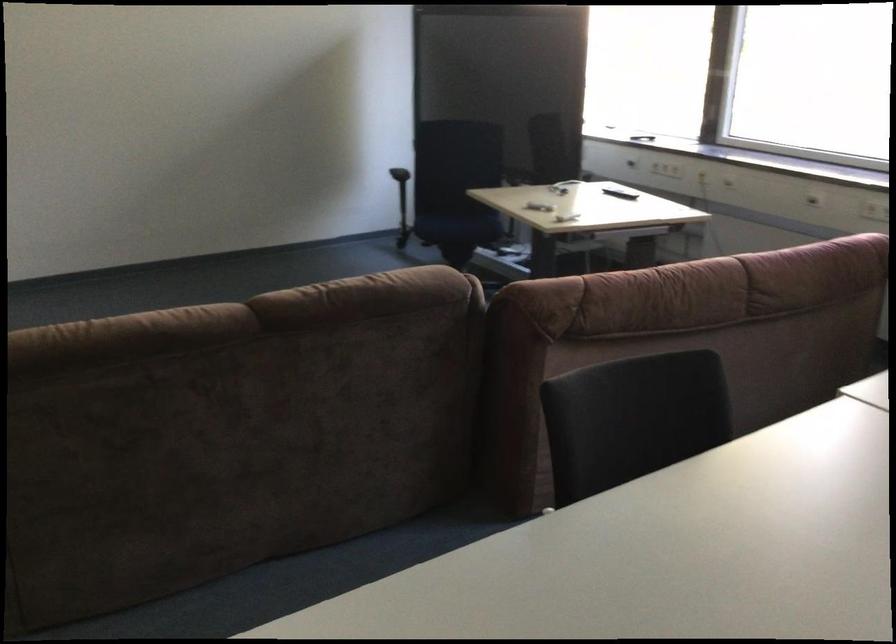
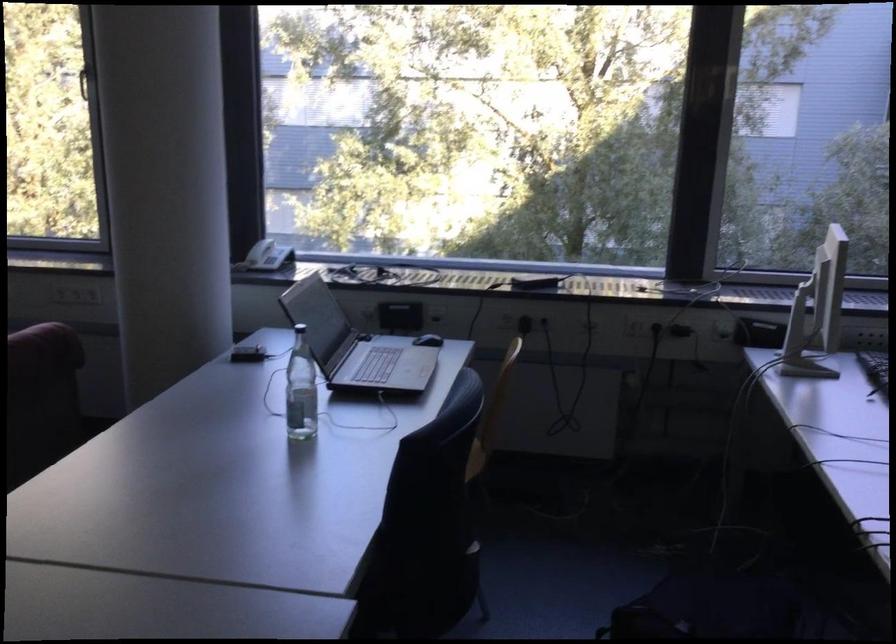
Question: How did the camera likely rotate?

Choices:
 (A) Left
 (B) Right
 (C) Up
 (D) Down

Answer: (B)